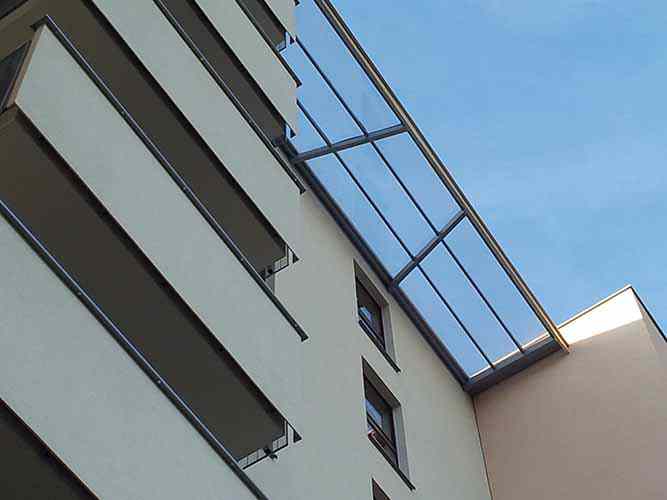
Find the location of a particular element. windows is located at coordinates (366, 303), (381, 404).